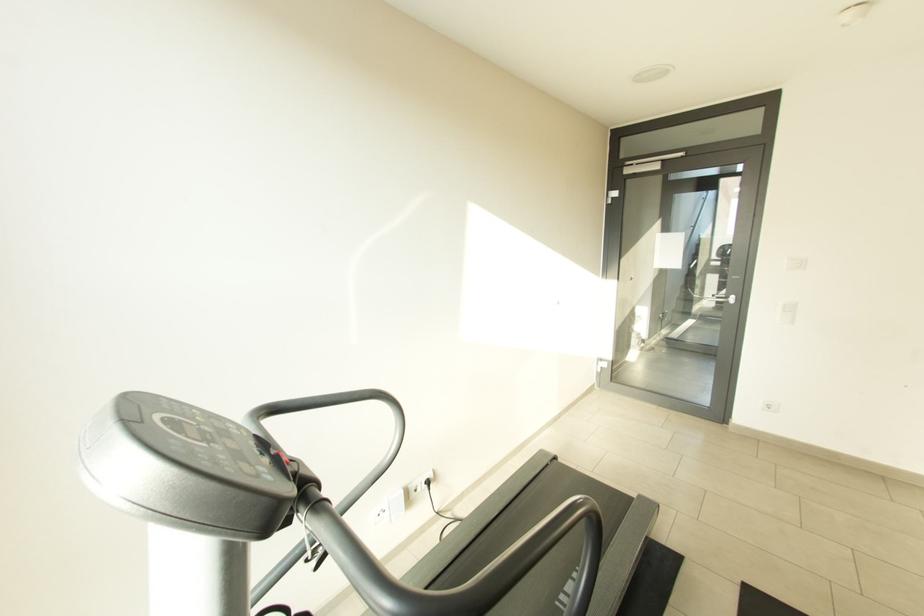
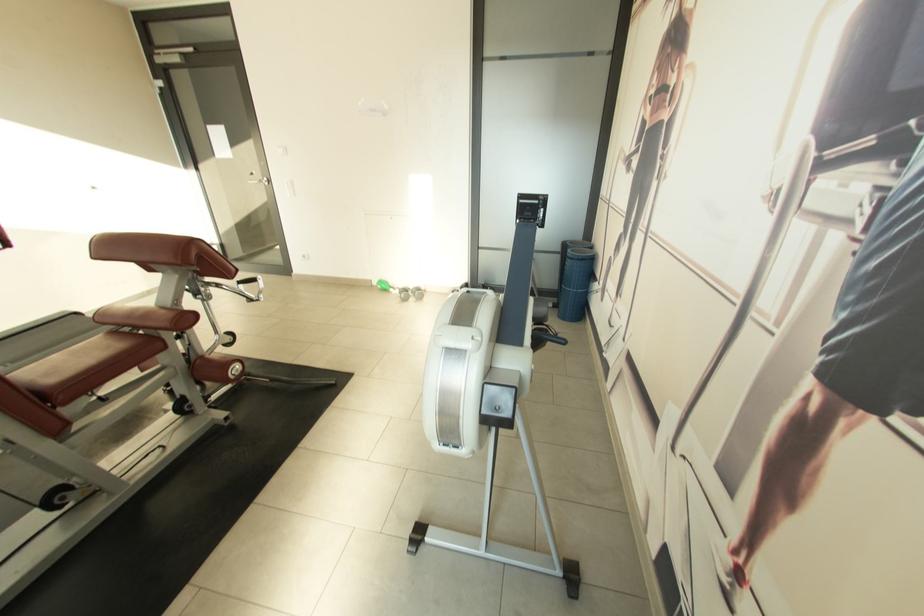
Where in the second image is the point corresponding to (x=637, y=280) from the first image?

(258, 175)